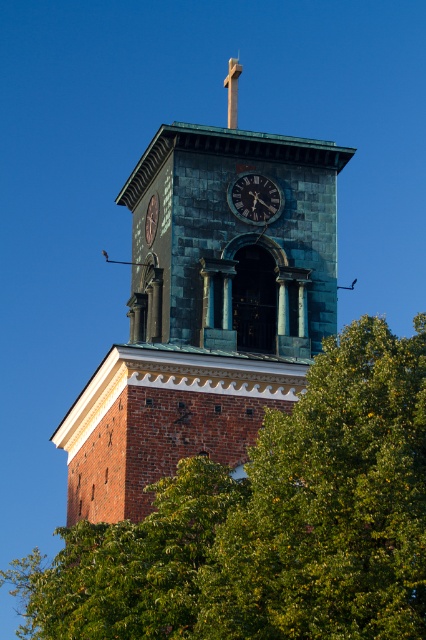
Question: Estimate the real-world distances between objects in this image. Which object is closer to the green patina clock tower at center?

Choices:
 (A) dark blue metallic clock at center
 (B) smooth gold cross at upper center

Answer: (A)

Question: Based on their relative distances, which object is nearer to the dark blue metallic clock at center?

Choices:
 (A) green leafy tree at center
 (B) smooth gold cross at upper center
 (C) green patina clock tower at center

Answer: (C)

Question: Based on their relative distances, which object is farther from the smooth gold cross at upper center?

Choices:
 (A) green leafy tree at center
 (B) dark blue metallic clock at center
 (C) green patina clock tower at center

Answer: (B)

Question: Is green patina clock tower at center below dark blue metallic clock at center?

Choices:
 (A) yes
 (B) no

Answer: (A)

Question: Is green leafy tree at center to the left of dark blue metallic clock at center from the viewer's perspective?

Choices:
 (A) yes
 (B) no

Answer: (B)

Question: Does green patina clock tower at center have a smaller size compared to smooth gold cross at upper center?

Choices:
 (A) yes
 (B) no

Answer: (B)